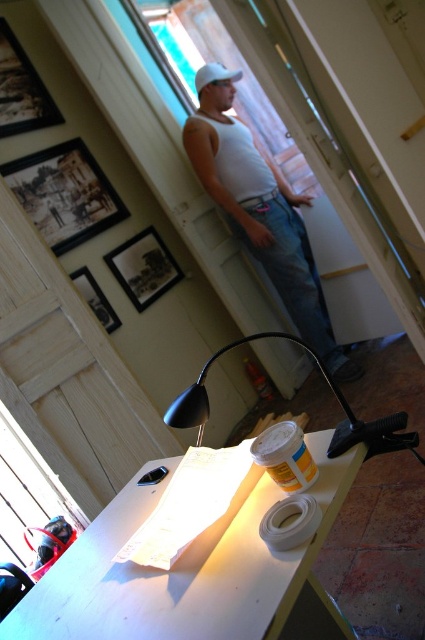
You are an interior designer assessing the placement of items in the room. Considering the wooden framed picture at upper left and the white matte tape at lower center, which object is positioned higher up in the room?

The wooden framed picture at upper left is positioned higher up in the room than the white matte tape at lower center.